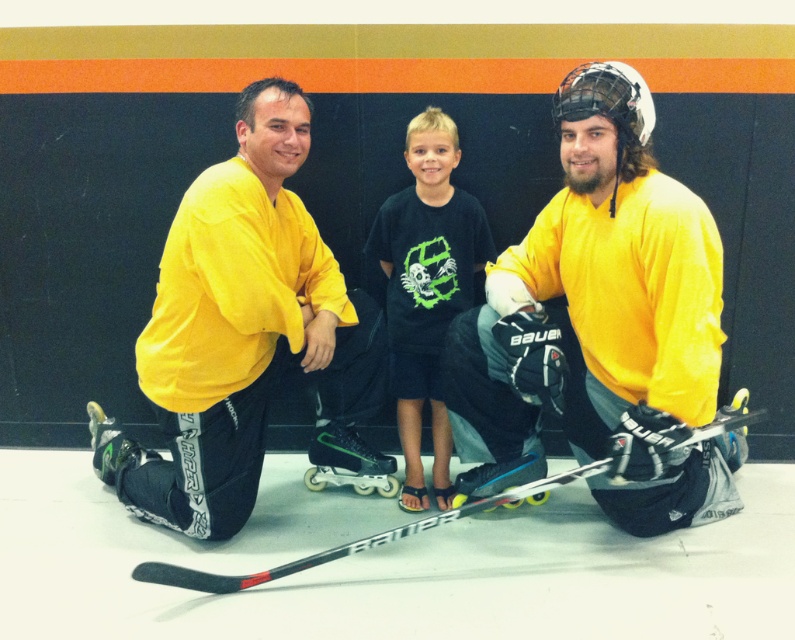
Question: Which object is farther from the camera taking this photo?

Choices:
 (A) black matte hockey stick at center
 (B) black cotton shirt at center
 (C) matte yellow jersey at center

Answer: (B)

Question: Which point appears farthest from the camera in this image?

Choices:
 (A) (596, 465)
 (B) (720, 330)
 (C) (247, 285)
 (D) (392, 275)

Answer: (D)

Question: Is yellow matte hockey jersey at right closer to the viewer compared to black matte hockey stick at center?

Choices:
 (A) no
 (B) yes

Answer: (B)

Question: Can you confirm if matte yellow jersey at center is positioned to the right of black matte hockey stick at center?

Choices:
 (A) no
 (B) yes

Answer: (A)

Question: Which is farther from the black cotton shirt at center?

Choices:
 (A) matte yellow jersey at center
 (B) yellow matte hockey jersey at right
 (C) black matte hockey stick at center

Answer: (C)

Question: Is matte yellow jersey at center to the left of black matte hockey stick at center from the viewer's perspective?

Choices:
 (A) no
 (B) yes

Answer: (B)